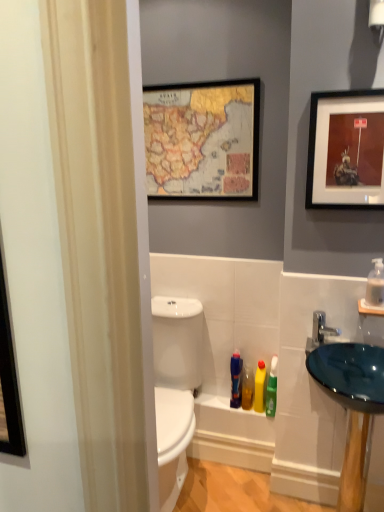
Question: Are translucent plastic bottle at lower center, marked as the 3th toiletry in a right-to-left arrangement, and wooden-framed map at upper center, placed as the 2th picture frame when sorted from front to back, located far from each other?

Choices:
 (A) no
 (B) yes

Answer: (B)

Question: Is translucent plastic bottle at lower center, the 2th toiletry in the left-to-right sequence, to the left of wooden-framed map at upper center, the second picture frame in the right-to-left sequence, from the viewer's perspective?

Choices:
 (A) no
 (B) yes

Answer: (A)

Question: Considering the relative sizes of translucent plastic bottle at lower center, the 2th toiletry in the left-to-right sequence, and wooden-framed map at upper center, the second picture frame in the right-to-left sequence, in the image provided, is translucent plastic bottle at lower center, the 2th toiletry in the left-to-right sequence, shorter than wooden-framed map at upper center, the second picture frame in the right-to-left sequence,?

Choices:
 (A) yes
 (B) no

Answer: (A)

Question: Is translucent plastic bottle at lower center, the 2th toiletry in the left-to-right sequence, positioned with its back to wooden-framed map at upper center, positioned as the 1th picture frame in left-to-right order?

Choices:
 (A) no
 (B) yes

Answer: (A)

Question: Is the position of translucent plastic bottle at lower center, the 2th toiletry in the left-to-right sequence, less distant than that of wooden-framed map at upper center, the second picture frame in the right-to-left sequence?

Choices:
 (A) yes
 (B) no

Answer: (B)

Question: Considering the relative positions of translucent plastic bottle at lower center, marked as the 3th toiletry in a right-to-left arrangement, and wooden-framed map at upper center, positioned as the 1th picture frame in left-to-right order, in the image provided, is translucent plastic bottle at lower center, marked as the 3th toiletry in a right-to-left arrangement, to the right of wooden-framed map at upper center, positioned as the 1th picture frame in left-to-right order, from the viewer's perspective?

Choices:
 (A) no
 (B) yes

Answer: (B)

Question: Considering the relative sizes of blue glass sink at right and translucent plastic bottle at lower center, placed as the fourth toiletry when sorted from right to left, in the image provided, is blue glass sink at right bigger than translucent plastic bottle at lower center, placed as the fourth toiletry when sorted from right to left,?

Choices:
 (A) no
 (B) yes

Answer: (A)

Question: From a real-world perspective, is blue glass sink at right over translucent plastic bottle at lower center, placed as the fourth toiletry when sorted from right to left?

Choices:
 (A) yes
 (B) no

Answer: (A)

Question: Is blue glass sink at right positioned far away from translucent plastic bottle at lower center, placed as the fourth toiletry when sorted from right to left?

Choices:
 (A) yes
 (B) no

Answer: (B)

Question: Is blue glass sink at right oriented away from translucent plastic bottle at lower center, which appears as the 1th toiletry when viewed from the left?

Choices:
 (A) yes
 (B) no

Answer: (B)

Question: Does blue glass sink at right have a greater width compared to translucent plastic bottle at lower center, which appears as the 1th toiletry when viewed from the left?

Choices:
 (A) yes
 (B) no

Answer: (A)

Question: Does blue glass sink at right appear on the right side of translucent plastic bottle at lower center, placed as the fourth toiletry when sorted from right to left?

Choices:
 (A) no
 (B) yes

Answer: (B)

Question: Is wooden-framed map at upper center, the second picture frame in the right-to-left sequence, facing away from blue glass sink at right?

Choices:
 (A) no
 (B) yes

Answer: (A)